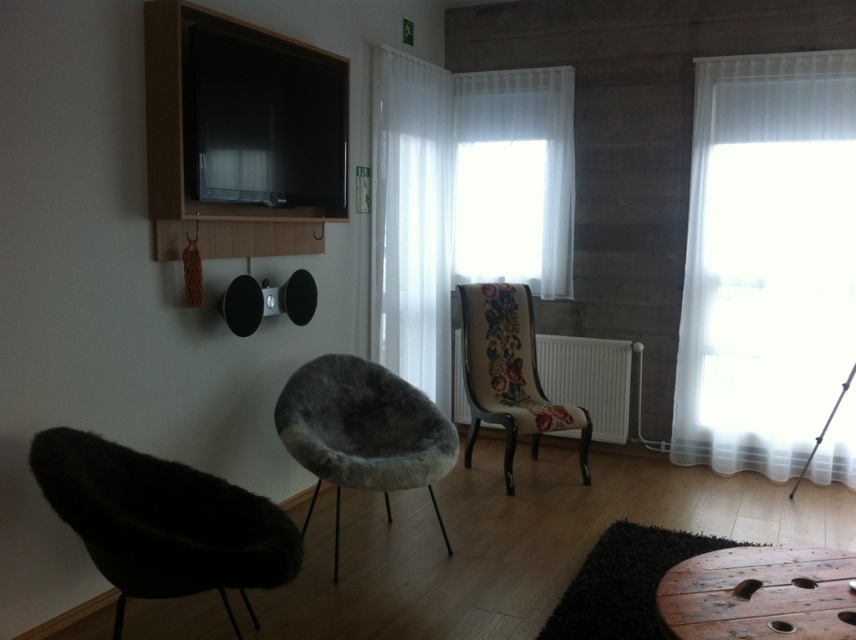
You are sitting on the dark brown fur armchair at lower left and want to move to the fuzzy gray armchair at center. Which direction should you move to reach it?

To reach the fuzzy gray armchair at center from the dark brown fur armchair at lower left, you should move upward since the dark brown fur armchair at lower left is below the fuzzy gray armchair at center.

You are a delivery person trying to deliver a package to the living room. The package is 8 feet long and needs to be placed between the white sheer curtain at center and dark brown fur armchair at lower left. Can the package fit in that space?

The white sheer curtain at center is 8.04 feet from the dark brown fur armchair at lower left. Since the package is 8 feet long, it can fit in the space as the distance is slightly longer than the package.

You are standing in the living room and want to know which white sheer curtain is taller. Can you tell me which one between the white sheer curtain at right and the white sheer curtain at center is taller?

The white sheer curtain at right is taller than the white sheer curtain at center according to the description.